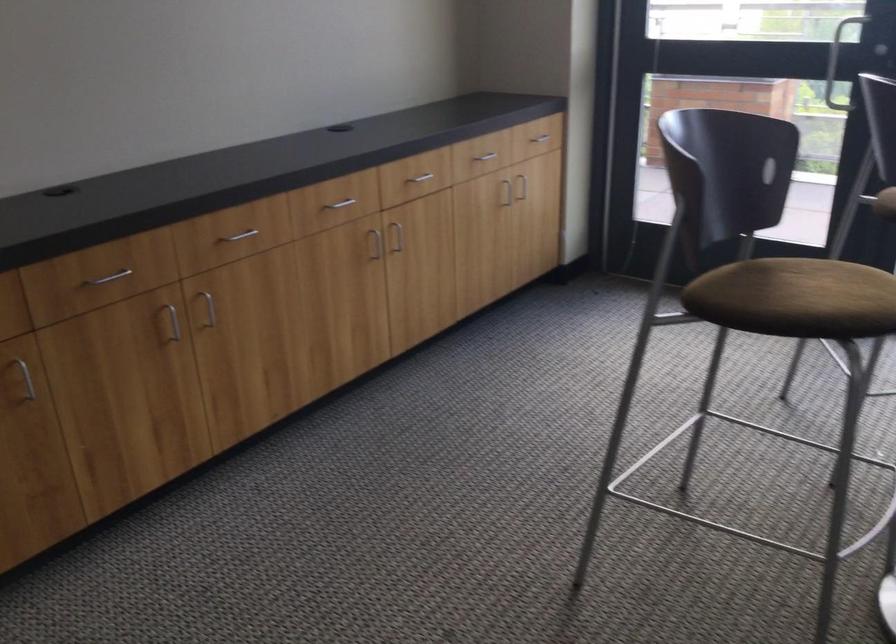
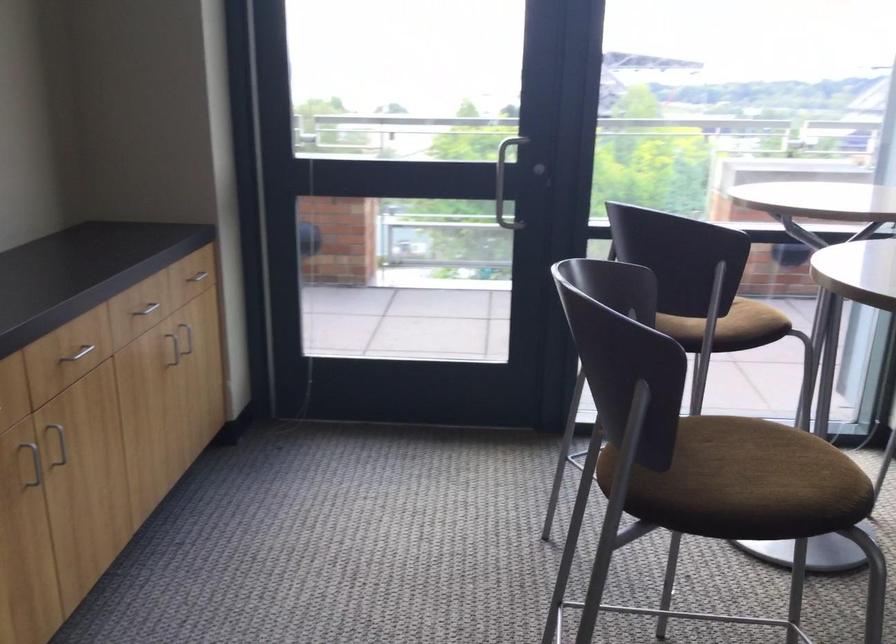
The point at (520, 178) is marked in the first image. Where is the corresponding point in the second image?

(188, 337)